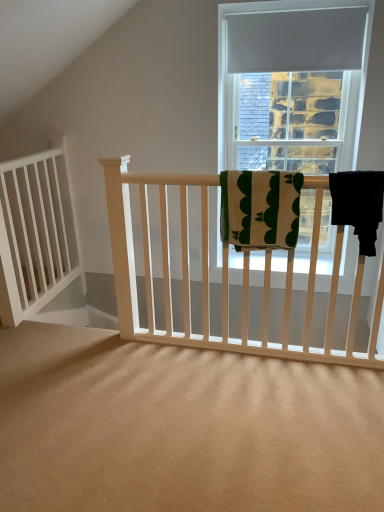
Question: Is matte gray curtain at upper center in front of white wood balustrade at left?

Choices:
 (A) yes
 (B) no

Answer: (B)

Question: Does matte gray curtain at upper center turn towards white wood balustrade at left?

Choices:
 (A) no
 (B) yes

Answer: (A)

Question: From the image's perspective, is matte gray curtain at upper center located beneath white wood balustrade at left?

Choices:
 (A) yes
 (B) no

Answer: (B)

Question: Is matte gray curtain at upper center further to camera compared to white wood balustrade at left?

Choices:
 (A) no
 (B) yes

Answer: (B)

Question: Does matte gray curtain at upper center have a larger size compared to white wood balustrade at left?

Choices:
 (A) no
 (B) yes

Answer: (A)

Question: Is matte gray curtain at upper center oriented away from white wood balustrade at left?

Choices:
 (A) no
 (B) yes

Answer: (A)

Question: Is green cotton towel at center, the first beach towel positioned from the left, further to camera compared to white wood balustrade at left?

Choices:
 (A) yes
 (B) no

Answer: (B)

Question: Is green cotton towel at center, the first beach towel positioned from the left, oriented towards white wood balustrade at left?

Choices:
 (A) no
 (B) yes

Answer: (A)

Question: Can you confirm if green cotton towel at center, the first beach towel positioned from the left, is wider than white wood balustrade at left?

Choices:
 (A) yes
 (B) no

Answer: (A)

Question: Is green cotton towel at center, the first beach towel positioned from the left, oriented away from white wood balustrade at left?

Choices:
 (A) no
 (B) yes

Answer: (A)

Question: Is green cotton towel at center, the first beach towel positioned from the left, at the right side of white wood balustrade at left?

Choices:
 (A) yes
 (B) no

Answer: (A)

Question: Does green cotton towel at center, the 2th beach towel positioned from the right, have a lesser width compared to white wood balustrade at left?

Choices:
 (A) no
 (B) yes

Answer: (A)

Question: Could you tell me if white wood balustrade at left is turned towards matte gray curtain at upper center?

Choices:
 (A) no
 (B) yes

Answer: (B)